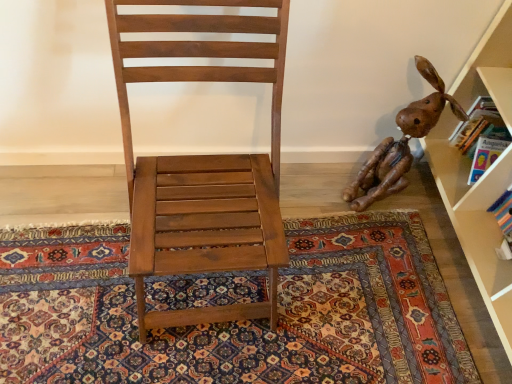
Where is `empty space that is ontop of carpeted floor at center (from a real-world perspective)`? This screenshot has height=384, width=512. empty space that is ontop of carpeted floor at center (from a real-world perspective) is located at coordinates (193, 326).